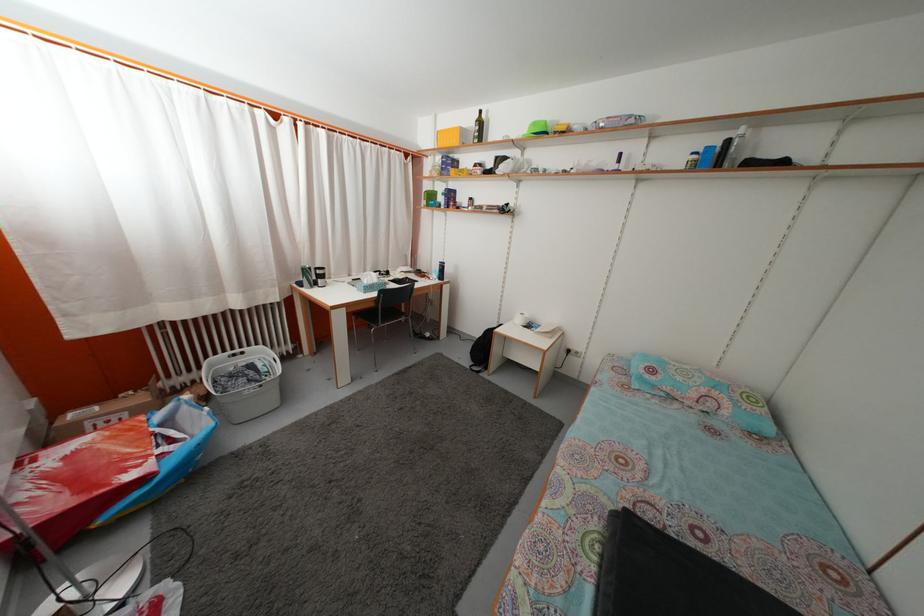
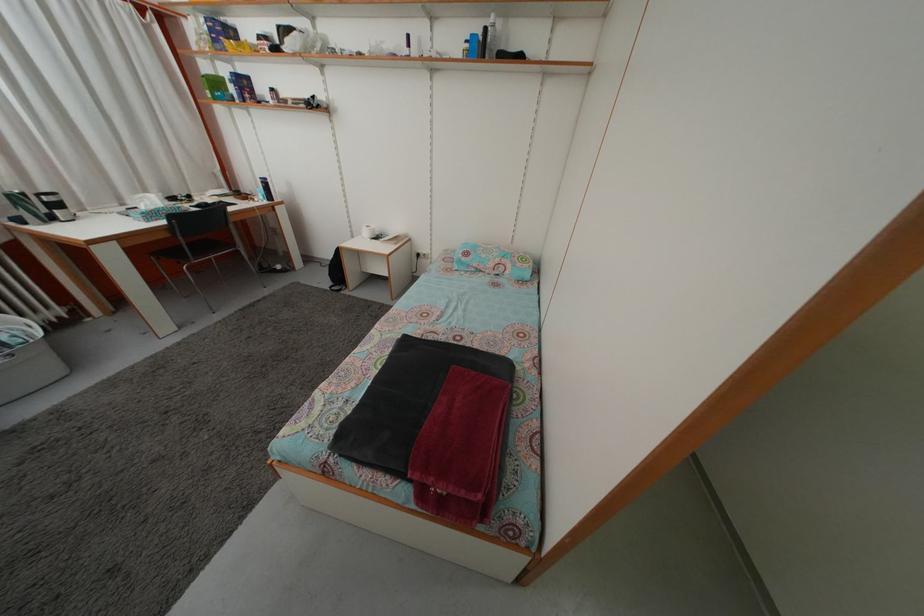
Locate, in the second image, the point that corresponds to the point at 482,342 in the first image.

(335, 262)